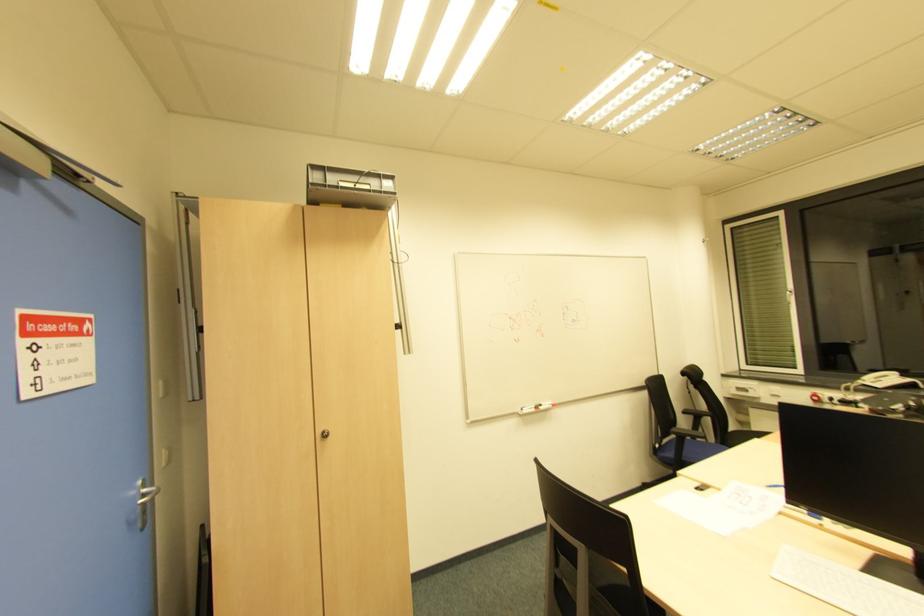
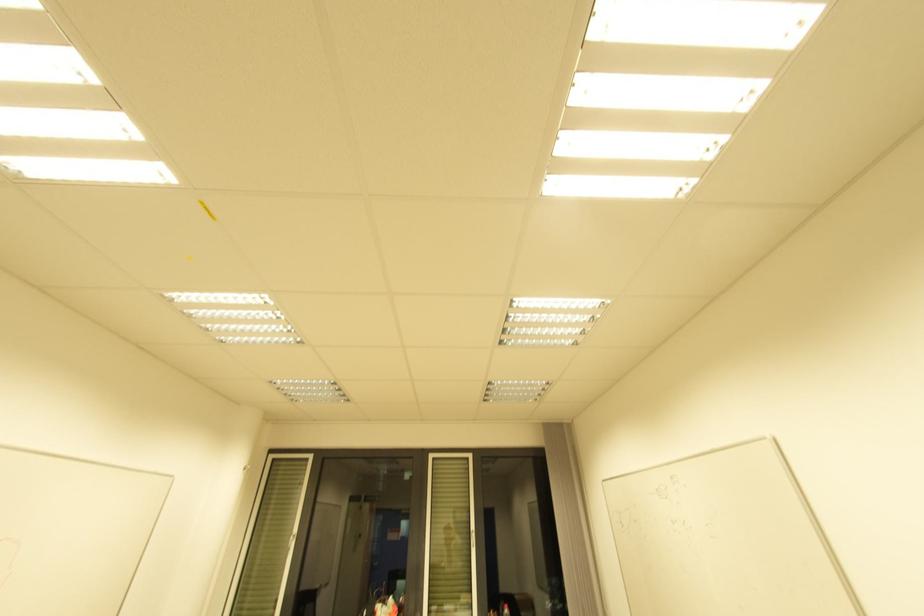
The point at [792,293] is marked in the first image. Where is the corresponding point in the second image?

(294, 538)